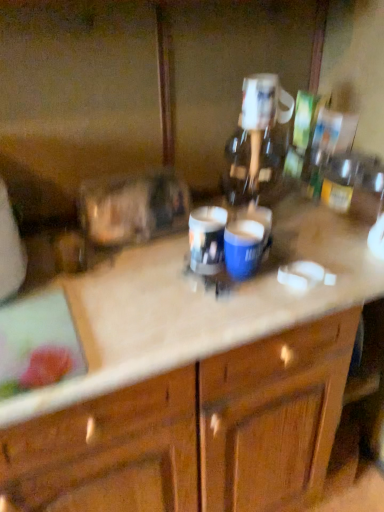
Locate an element on the screen. vacant region above beige marble countertop at center (from a real-world perspective) is located at coordinates (188, 268).